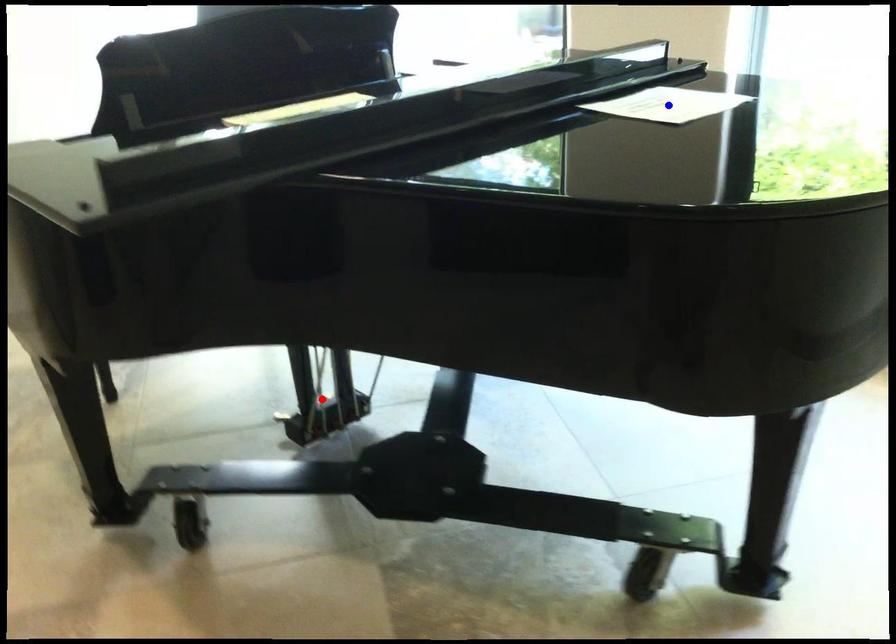
Question: Two points are marked on the image. Which point is closer to the camera?

Choices:
 (A) Blue point is closer.
 (B) Red point is closer.

Answer: (A)